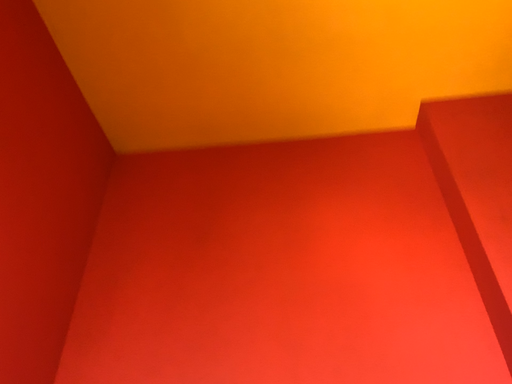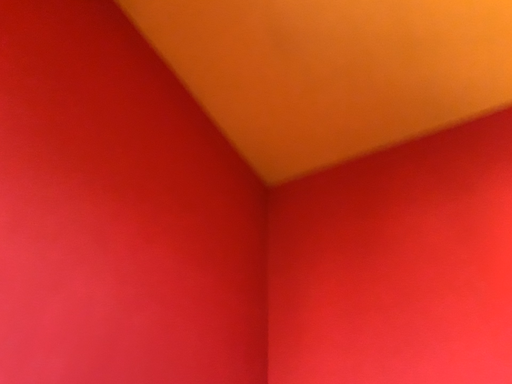
Question: How did the camera likely rotate when shooting the video?

Choices:
 (A) rotated left
 (B) rotated right

Answer: (A)